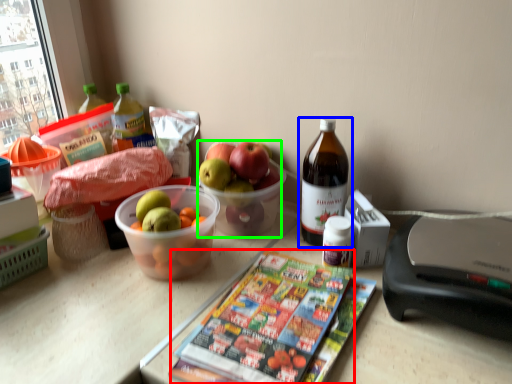
Question: Which object is the closest to the magazine (highlighted by a red box)? Choose among these: bottle (highlighted by a blue box) or grapefruit (highlighted by a green box).

Choices:
 (A) bottle
 (B) grapefruit

Answer: (A)